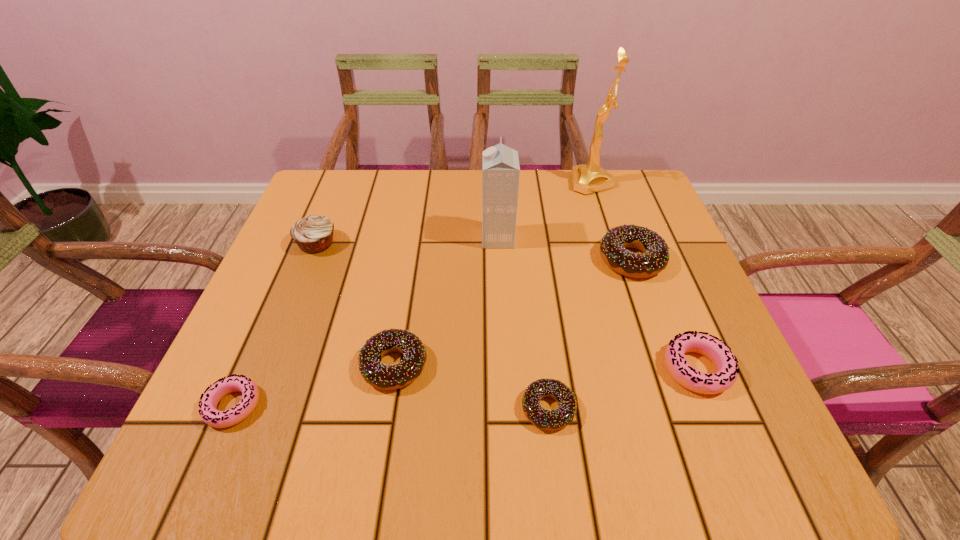
The image size is (960, 540). Find the location of `the third doughnut from left to right`. the third doughnut from left to right is located at coordinates (563, 415).

This screenshot has height=540, width=960. What are the coordinates of `the left pink doughnut` in the screenshot? It's located at (208, 411).

Find the location of a particular element. The width and height of the screenshot is (960, 540). the smaller pink doughnut is located at coordinates (208, 411).

At what (x,y) coordinates should I click in order to perform the action: click on vacant area situated on the front-facing side of the farthest object. Please return your answer as a coordinate pair (x, y). Image resolution: width=960 pixels, height=540 pixels. Looking at the image, I should click on pyautogui.click(x=488, y=183).

Locate an element on the screen. The image size is (960, 540). vacant point located on the front-facing side of the farthest object is located at coordinates (553, 183).

The image size is (960, 540). Find the location of `blank space located on the front-facing side of the farthest object`. blank space located on the front-facing side of the farthest object is located at coordinates (502, 183).

Where is `vacant region located on the front label of the carton`? vacant region located on the front label of the carton is located at coordinates [390, 238].

You are a GUI agent. You are given a task and a screenshot of the screen. Output one action in this format:
    pyautogui.click(x=<x>, y=<y>)
    Task: Click on the free spot located 0.280m on the front label of the carton
    The width and height of the screenshot is (960, 540).
    Given the screenshot: What is the action you would take?
    pyautogui.click(x=364, y=238)

Identify the location of vacant area located on the front label of the carton. This screenshot has width=960, height=540. (457, 238).

You are a GUI agent. You are given a task and a screenshot of the screen. Output one action in this format:
    pyautogui.click(x=<x>, y=<y>)
    Task: Click on the vacant space situated 0.390m on the front of the muffin
    This screenshot has width=960, height=540.
    Given the screenshot: What is the action you would take?
    pyautogui.click(x=248, y=417)